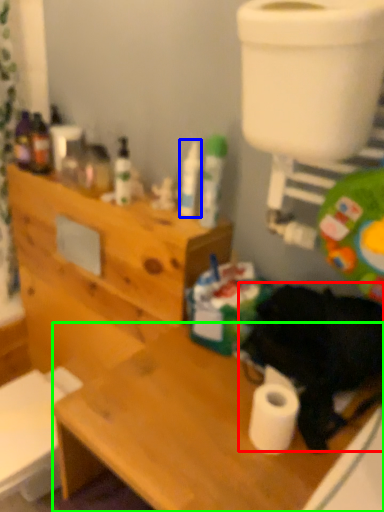
Question: Considering the real-world distances, which object is farthest from animal (highlighted by a red box)? toiletry (highlighted by a blue box) or desk (highlighted by a green box)?

Choices:
 (A) toiletry
 (B) desk

Answer: (A)